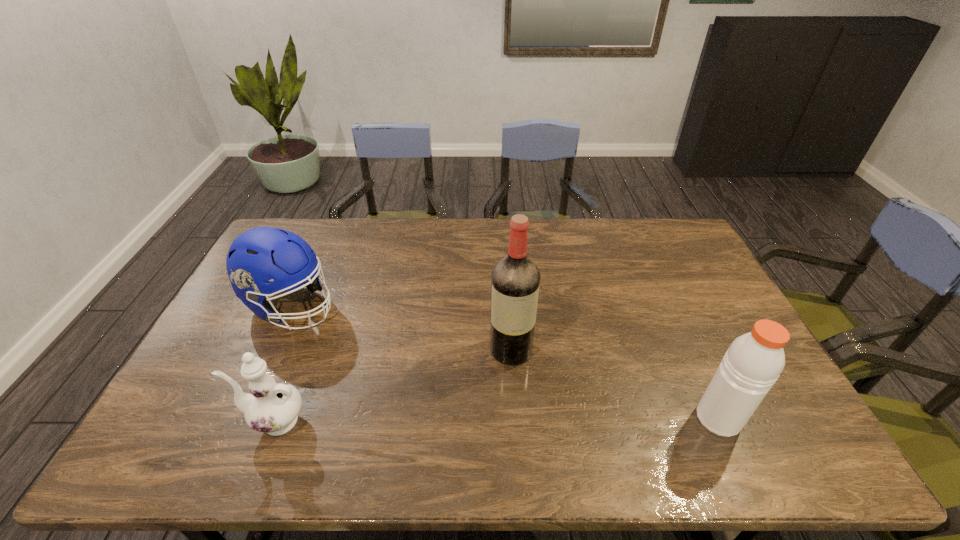
Locate an element on the screen. blank region between the chinaware and the tallest object is located at coordinates (393, 386).

Find the location of `the third closest object relative to the chinaware`. the third closest object relative to the chinaware is located at coordinates (753, 362).

Locate which object is the closest to the tallest object. Please provide its 2D coordinates. Your answer should be formatted as a tuple, i.e. [(x, y)], where the tuple contains the x and y coordinates of a point satisfying the conditions above.

[(753, 362)]

The image size is (960, 540). In order to click on vacant space that satisfies the following two spatial constraints: 1. on the front side of the football helmet; 2. at the spout of the chinaware in this screenshot , I will do `click(239, 421)`.

I want to click on vacant space that satisfies the following two spatial constraints: 1. on the front side of the chinaware; 2. at the spout of the football helmet, so click(x=239, y=421).

I want to click on free space that satisfies the following two spatial constraints: 1. on the front side of the chinaware; 2. at the spout of the football helmet, so click(239, 421).